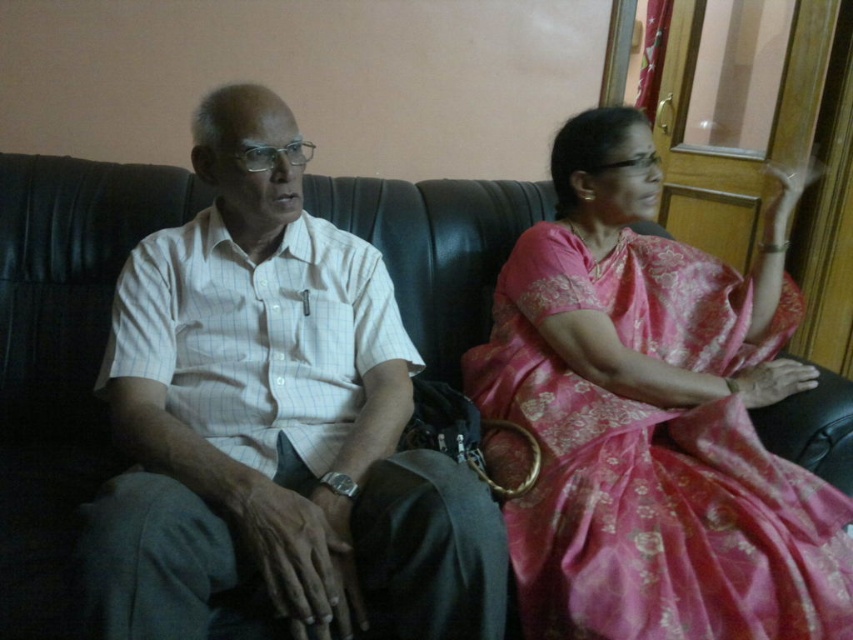
Can you confirm if white striped shirt at center is taller than pink silk saree at right?

No, white striped shirt at center is not taller than pink silk saree at right.

This screenshot has height=640, width=853. Describe the element at coordinates (274, 420) in the screenshot. I see `white striped shirt at center` at that location.

At what (x,y) coordinates should I click in order to perform the action: click on white striped shirt at center. Please return your answer as a coordinate pair (x, y). Looking at the image, I should click on (274, 420).